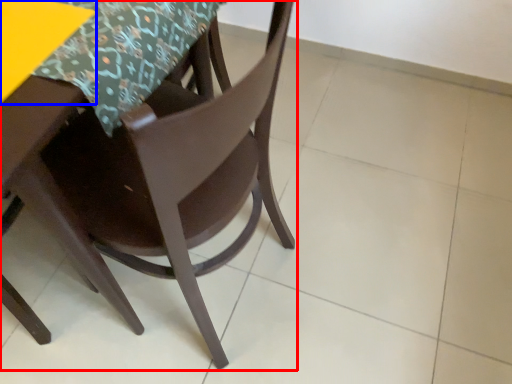
Question: Which object appears closest to the camera in this image, chair (highlighted by a red box) or table (highlighted by a blue box)?

Choices:
 (A) chair
 (B) table

Answer: (A)